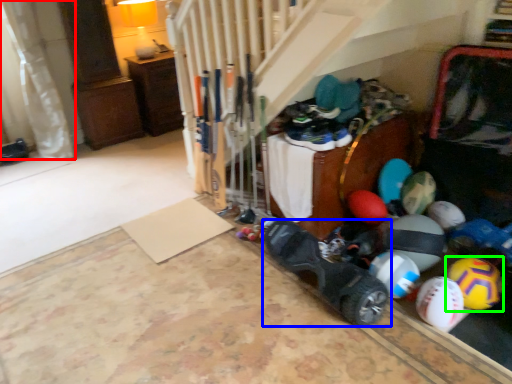
Question: Considering the real-world distances, which object is closest to curtain (highlighted by a red box)? footwear (highlighted by a blue box) or beach ball (highlighted by a green box).

Choices:
 (A) footwear
 (B) beach ball

Answer: (A)